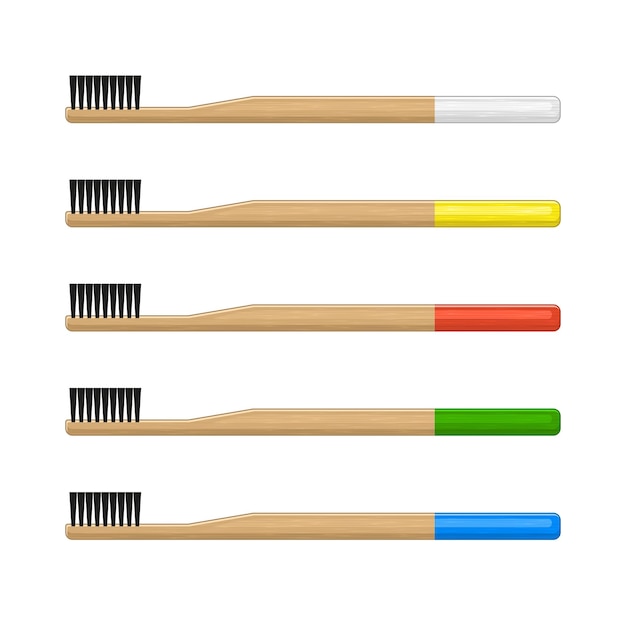
You are a GUI agent. You are given a task and a screenshot of the screen. Output one action in this format:
    pyautogui.click(x=<x>, y=<y>)
    Task: Click on the red paint
    Image resolution: width=626 pixels, height=626 pixels.
    Given the screenshot: What is the action you would take?
    pyautogui.click(x=488, y=322)